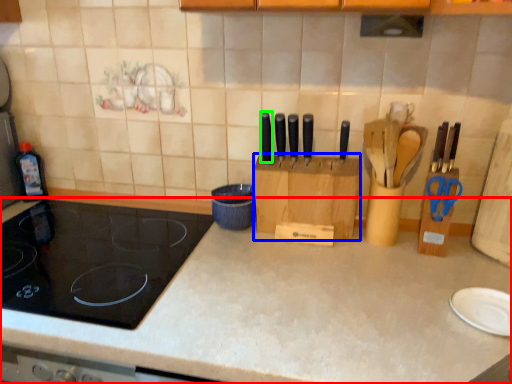
Question: Based on their relative distances, which object is nearer to countertop (highlighted by a red box)? Choose from cardboard box (highlighted by a blue box) and knife (highlighted by a green box).

Choices:
 (A) cardboard box
 (B) knife

Answer: (A)